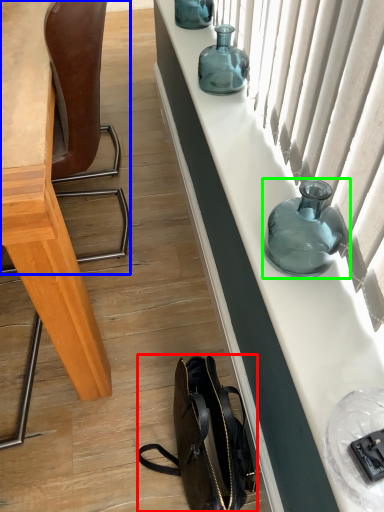
Question: Estimate the real-world distances between objects in this image. Which object is closer to handbag (highlighted by a red box), chair (highlighted by a blue box) or bottle (highlighted by a green box)?

Choices:
 (A) chair
 (B) bottle

Answer: (B)